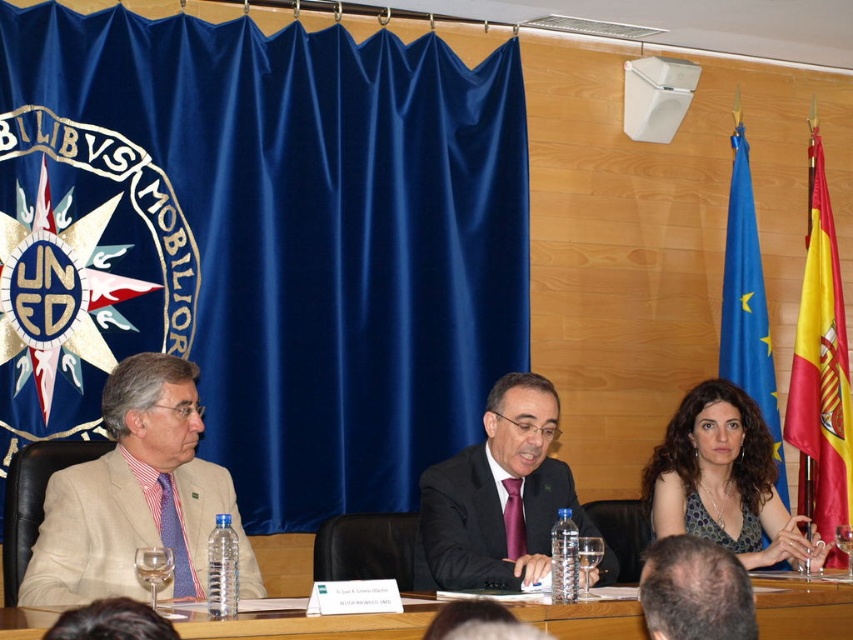
Question: Among these objects, which one is farthest from the camera?

Choices:
 (A) beige fabric suit at left
 (B) sparkly blue dress at center

Answer: (B)

Question: Does blue satin curtain at center appear on the left side of blue fabric curtain at upper right?

Choices:
 (A) yes
 (B) no

Answer: (A)

Question: Which point appears farthest from the camera in this image?

Choices:
 (A) (648, 602)
 (B) (827, 230)
 (C) (668, 449)
 (D) (223, 625)

Answer: (B)

Question: Does yellow/red fabric flag at right appear on the right side of smooth bald head at lower center?

Choices:
 (A) yes
 (B) no

Answer: (A)

Question: Does dark suit at center come behind wooden table at center?

Choices:
 (A) no
 (B) yes

Answer: (B)

Question: Which of the following is the farthest from the observer?

Choices:
 (A) (660, 576)
 (B) (1, 378)

Answer: (B)